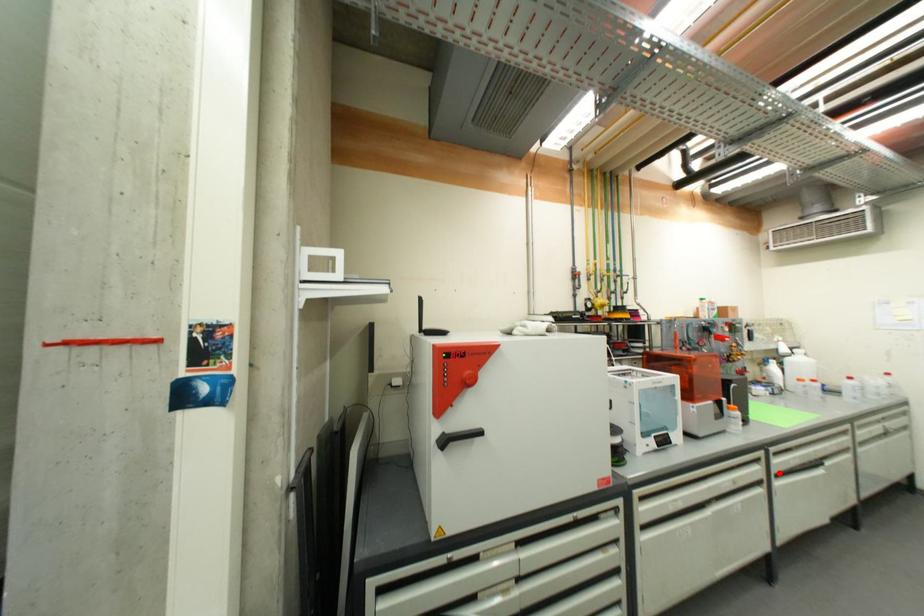
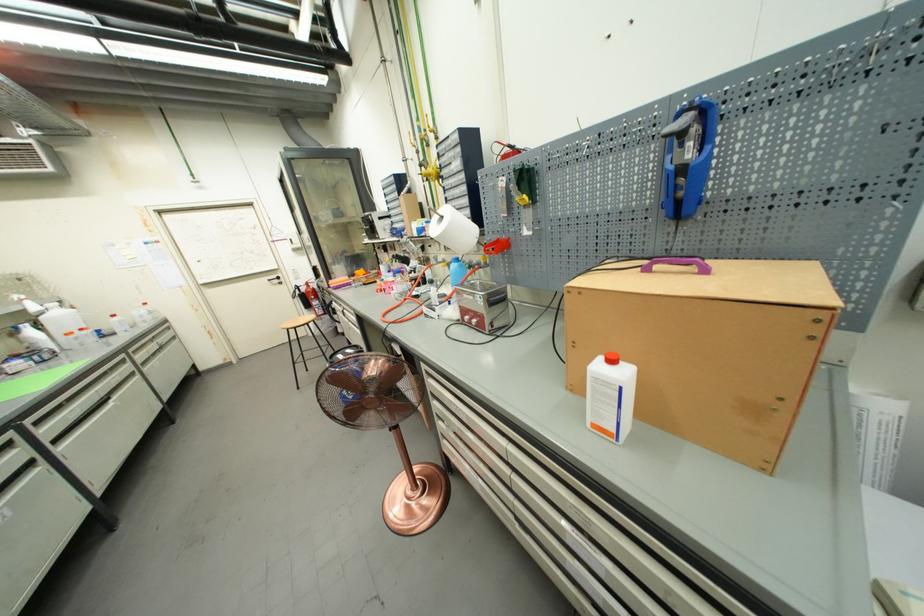
The point at the highlighted location is marked in the first image. Where is the corresponding point in the second image?

(52, 440)